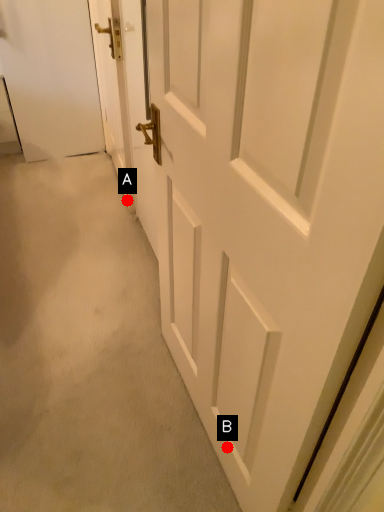
Question: Two points are circled on the image, labeled by A and B beside each circle. Which point is closer to the camera?

Choices:
 (A) A is closer
 (B) B is closer

Answer: (B)